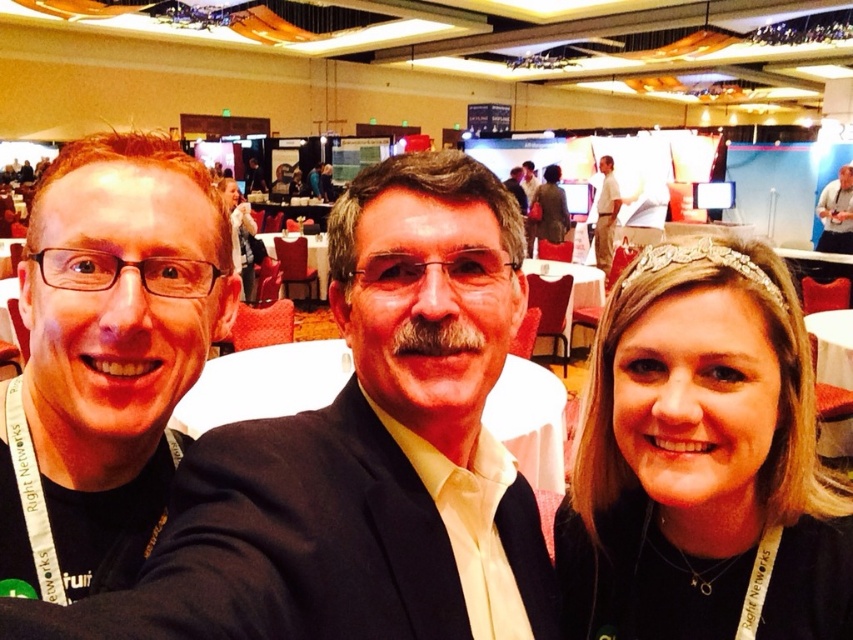
Question: Estimate the real-world distances between objects in this image. Which object is closer to the white glossy shirt at upper right?

Choices:
 (A) matte black suit at center
 (B) tan fabric shirt at upper center
 (C) black fabric at left

Answer: (B)

Question: Where is smooth black hair at center located in relation to black fabric at left in the image?

Choices:
 (A) left
 (B) right

Answer: (B)

Question: Is matte black suit at center smaller than white tablecloth at center?

Choices:
 (A) no
 (B) yes

Answer: (B)

Question: Which point is farther to the camera?

Choices:
 (A) matte black suit at center
 (B) white glossy shirt at upper right
 (C) white tablecloth at center
 (D) black fabric at left

Answer: (B)

Question: Does smooth black hair at center appear on the right side of white tablecloth at center?

Choices:
 (A) no
 (B) yes

Answer: (B)

Question: Which of the following is the farthest from the observer?

Choices:
 (A) (840, 230)
 (B) (793, 515)
 (C) (299, 292)

Answer: (A)